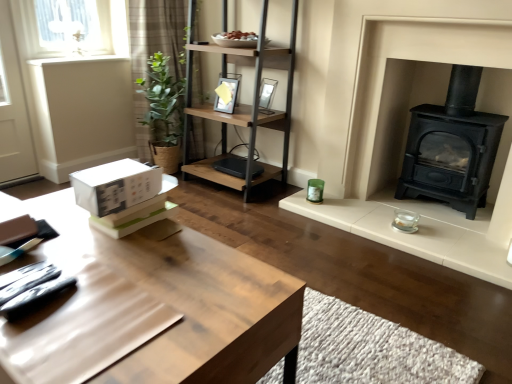
Where is `free point above white matte cardboard box at lower left (from a real-world perspective)`? free point above white matte cardboard box at lower left (from a real-world perspective) is located at coordinates (114, 170).